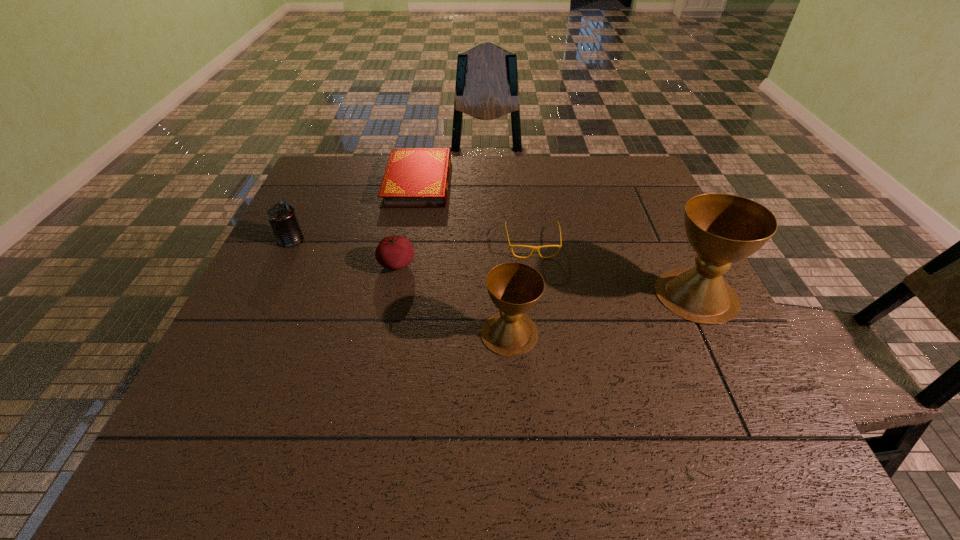
I want to click on unoccupied area between the third shortest object and the tallest object, so click(x=546, y=280).

Image resolution: width=960 pixels, height=540 pixels. In order to click on vacant region between the tallest object and the spectacles in this screenshot , I will do `click(614, 269)`.

Identify the location of free space between the leftmost object and the spectacles. This screenshot has height=540, width=960. (412, 242).

The image size is (960, 540). I want to click on free spot between the tomato and the left chalice, so click(x=453, y=299).

Identify which object is the third nearest to the spectacles. Please provide its 2D coordinates. Your answer should be formatted as a tuple, i.e. [(x, y)], where the tuple contains the x and y coordinates of a point satisfying the conditions above.

[(722, 228)]

Find the location of a particular element. The image size is (960, 540). object that can be found as the second closest to the leftmost object is located at coordinates (393, 252).

You are a GUI agent. You are given a task and a screenshot of the screen. Output one action in this format:
    pyautogui.click(x=<x>, y=<y>)
    Task: Click on the free space that satisfies the following two spatial constraints: 1. on the front side of the fourth tallest object; 2. on the left side of the right chalice
    This screenshot has height=540, width=960.
    Given the screenshot: What is the action you would take?
    pyautogui.click(x=391, y=295)